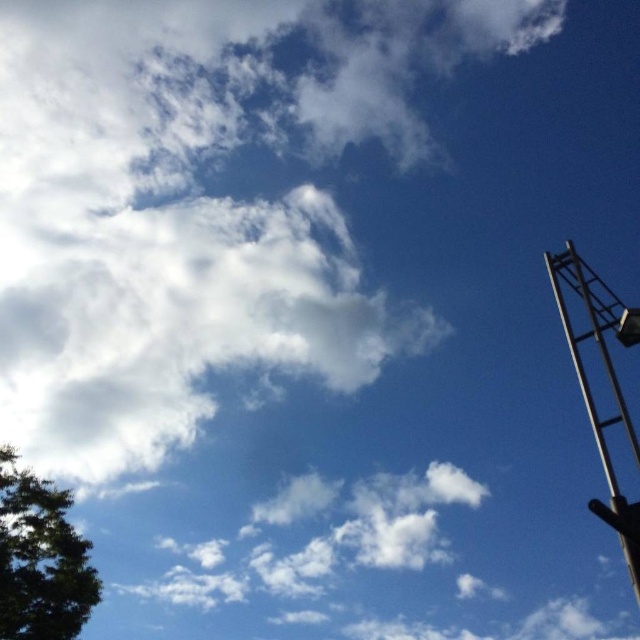
You are standing on the ground and looking up at the sky. You see the white fluffy cloud at upper center and the metallic silver crane at right. Which object is closer to you?

The metallic silver crane at right is closer to you because it is positioned at the right side of the frame, while the white fluffy cloud at upper center is further away in the sky.

Looking at this image, you are an airplane pilot flying at a high altitude. You see the metallic silver crane at right and the green leafy tree at lower left in your view. Which object is closer to your current position?

The green leafy tree at lower left is closer to your current position because the metallic silver crane at right is behind it.